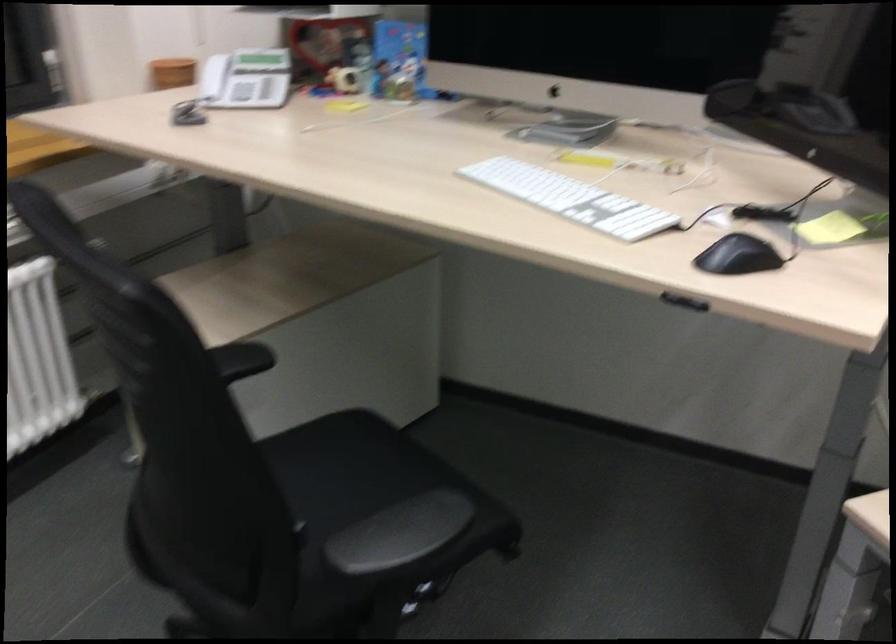
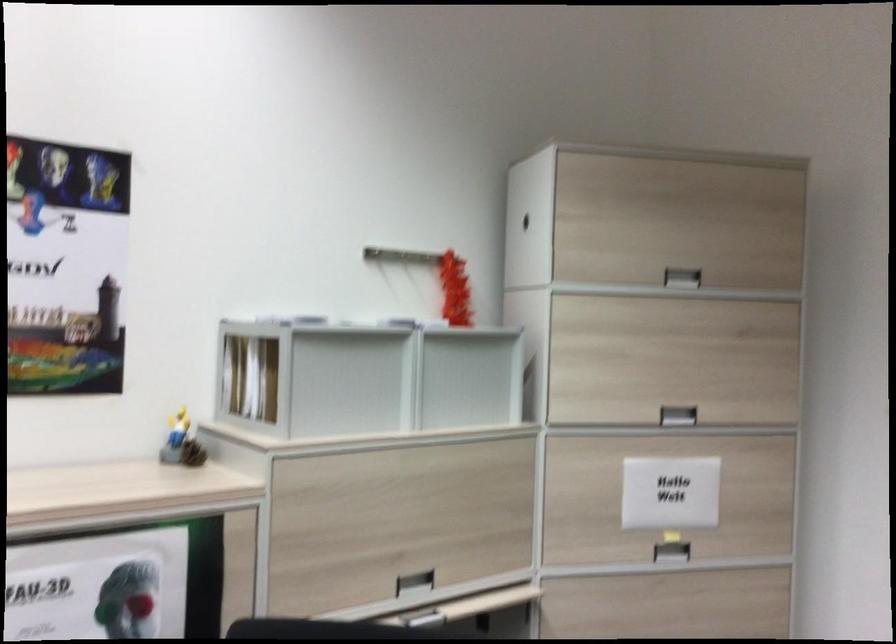
Question: The camera is either moving clockwise (left) or counter-clockwise (right) around the object. The first image is from the beginning of the video and the second image is from the end. Is the camera moving left or right when shooting the video?

Choices:
 (A) Left
 (B) Right

Answer: (A)